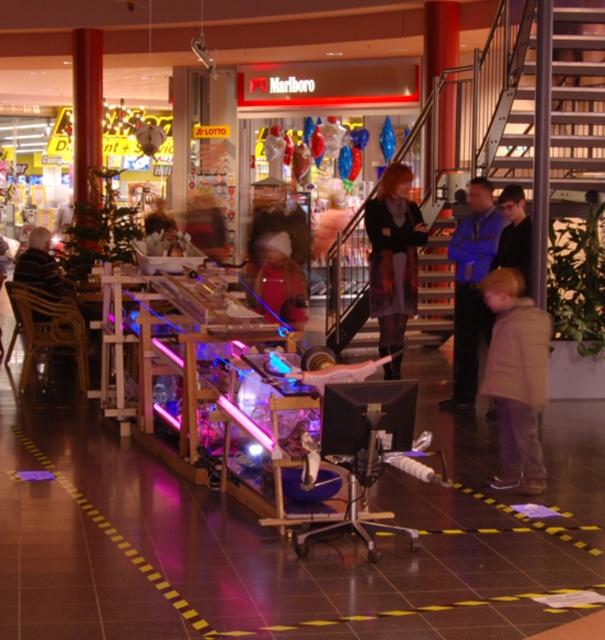
Identify the location of light brown wool coat at lower right. Image resolution: width=605 pixels, height=640 pixels. (517, 378).

Who is more forward, (495, 385) or (393, 243)?

Point (495, 385)

What do you see at coordinates (517, 378) in the screenshot?
I see `light brown wool coat at lower right` at bounding box center [517, 378].

Where is `light brown wool coat at lower right`? light brown wool coat at lower right is located at coordinates (517, 378).

Between gray wool coat at center and striped sweater at left, which one is positioned lower?

Positioned lower is gray wool coat at center.

Is gray wool coat at center bigger than striped sweater at left?

Correct, gray wool coat at center is larger in size than striped sweater at left.

Describe the element at coordinates (393, 253) in the screenshot. I see `gray wool coat at center` at that location.

The image size is (605, 640). I want to click on gray wool coat at center, so click(x=393, y=253).

Which of these two, light brown wool coat at lower right or striped sweater at left, stands taller?

light brown wool coat at lower right

At what (x,y) coordinates should I click in order to perform the action: click on light brown wool coat at lower right. Please return your answer as a coordinate pair (x, y). Image resolution: width=605 pixels, height=640 pixels. Looking at the image, I should click on (517, 378).